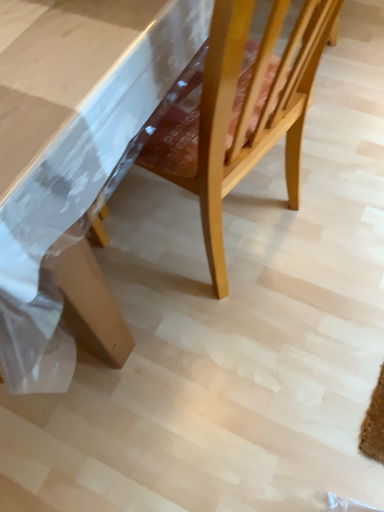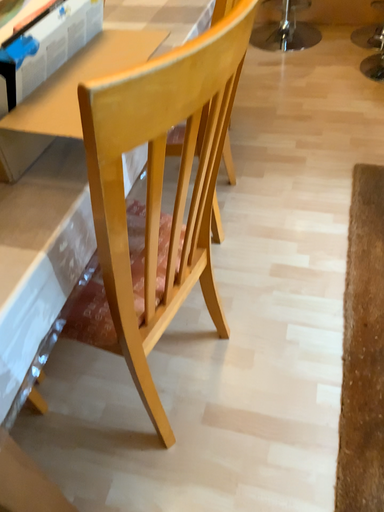
Question: How did the camera likely rotate when shooting the video?

Choices:
 (A) rotated downward
 (B) rotated upward

Answer: (B)